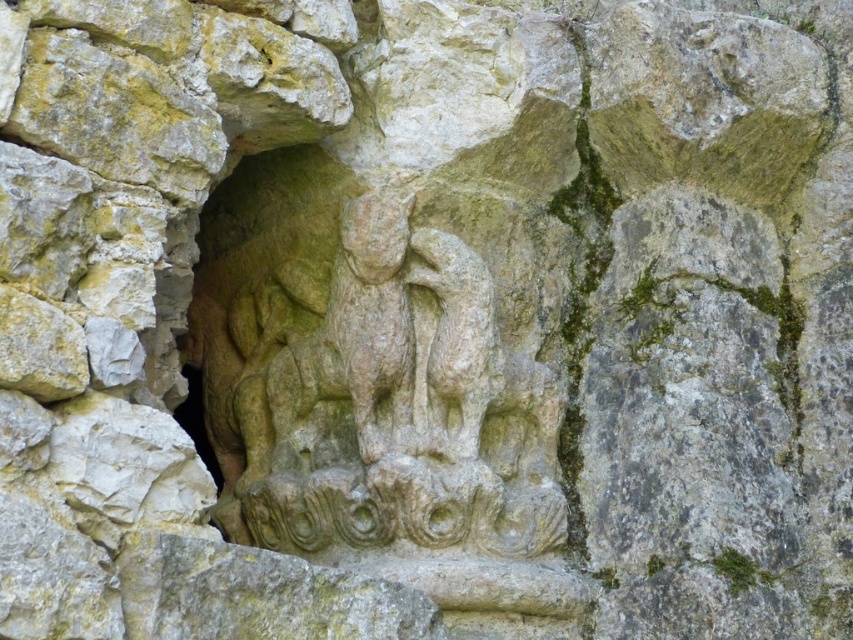
Does stone relief sculpture at center have a lesser width compared to stone carving at center?

No, stone relief sculpture at center is not thinner than stone carving at center.

Does point (381, 314) come behind point (361, 250)?

Yes, it is behind point (361, 250).

Where is `stone relief sculpture at center`? The height and width of the screenshot is (640, 853). stone relief sculpture at center is located at coordinates [381, 401].